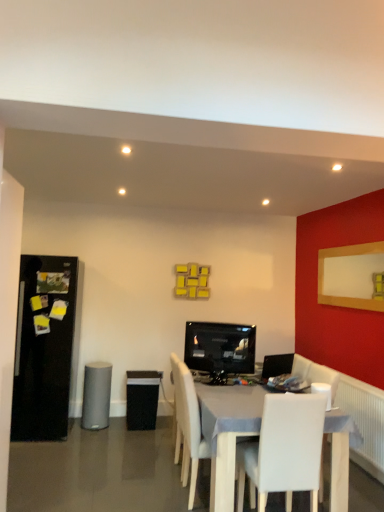
Locate an element on the screen. free space in front of gray matte speaker at lower left, placed as the 2th speaker when sorted from back to front is located at coordinates (97, 434).